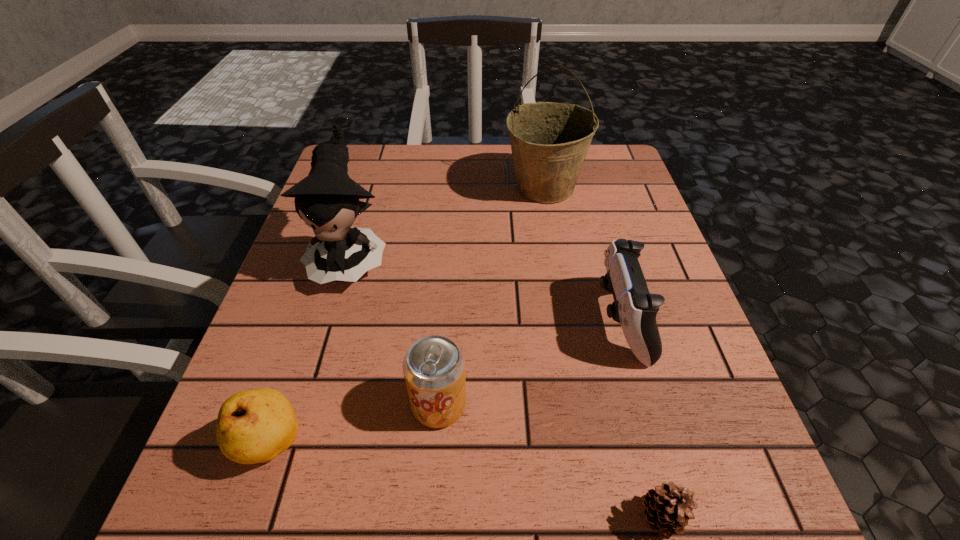
Find the location of `vacant space located 0.180m on the front-facing side of the control`. vacant space located 0.180m on the front-facing side of the control is located at coordinates (498, 321).

This screenshot has width=960, height=540. I want to click on free spot located 0.100m on the front of the fourth object from right to left, so pyautogui.click(x=432, y=503).

What are the coordinates of `free region located 0.180m on the right of the pear` in the screenshot? It's located at (428, 444).

Where is `object situated at the far edge`? The height and width of the screenshot is (540, 960). object situated at the far edge is located at coordinates (549, 141).

Find the location of a particular element. The height and width of the screenshot is (540, 960). object that is positioned at the near edge is located at coordinates (254, 426).

Identify the location of doll that is at the left edge. The image size is (960, 540). (327, 200).

At what (x,y) coordinates should I click in order to perform the action: click on pear situated at the left edge. Please return your answer as a coordinate pair (x, y). Image resolution: width=960 pixels, height=540 pixels. Looking at the image, I should click on (254, 426).

I want to click on wine bucket located in the right edge section of the desktop, so click(549, 141).

Locate an element on the screen. control present at the right edge is located at coordinates (634, 307).

I want to click on object at the near left corner, so click(254, 426).